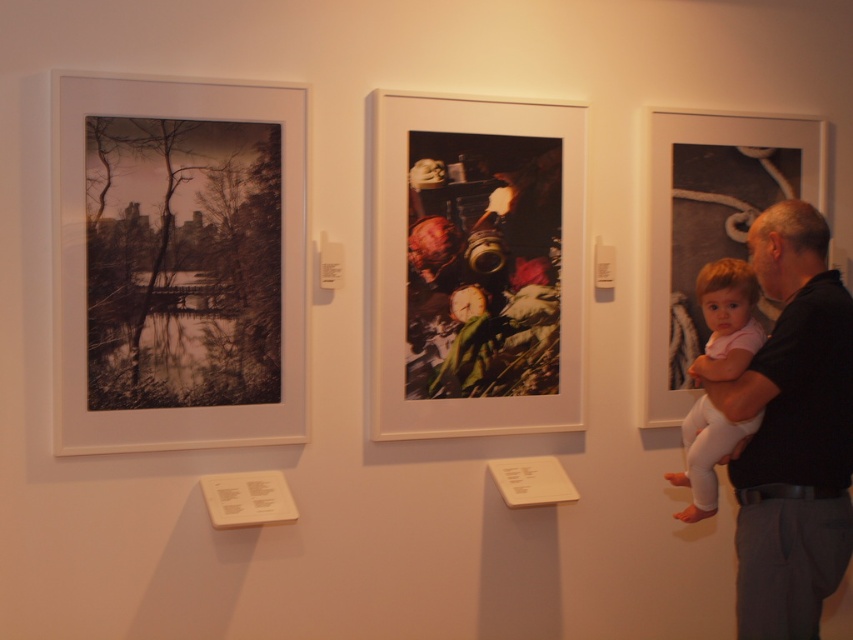
At what (x,y) coordinates should I click in order to perform the action: click on matte black frame at right. Please return your answer as a coordinate pair (x, y). The height and width of the screenshot is (640, 853). Looking at the image, I should click on (711, 224).

Which is more to the right, matte black frame at right or light pink fabric baby at right?

Positioned to the right is matte black frame at right.

Does point (659, 260) come in front of point (701, 358)?

No.

Where is `matte black frame at right`? This screenshot has height=640, width=853. matte black frame at right is located at coordinates (711, 224).

Between point (212, 173) and point (773, 202), which one is positioned behind?

Positioned behind is point (773, 202).

Find the location of a particular element. sepia-toned paper print at left is located at coordinates [178, 262].

Between sepia-toned paper print at left and metallic textured photograph at center, which one appears on the right side from the viewer's perspective?

metallic textured photograph at center

Consider the image. Which is above, sepia-toned paper print at left or metallic textured photograph at center?

metallic textured photograph at center

What do you see at coordinates (178, 262) in the screenshot? I see `sepia-toned paper print at left` at bounding box center [178, 262].

Locate an element on the screen. sepia-toned paper print at left is located at coordinates (178, 262).